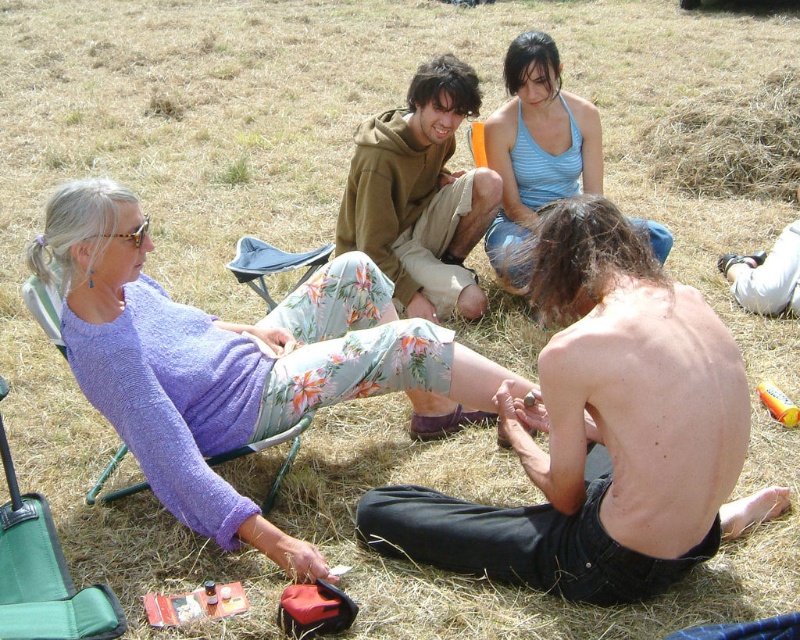
You are a photographer setting up a tripod between the green fabric folding chair at lower left and the green fabric chair at lower left. The tripod requires a minimum of 1.5 meters of space to set up. Can you fit the tripod between them?

The green fabric folding chair at lower left and the green fabric chair at lower left are 1.57 meters apart, which is just enough space to fit the tripod since it requires a minimum of 1.5 meters.

You are standing at the center of the grassy field and want to move towards the shiny black skin at lower right. Which direction should you walk to reach it?

To reach the shiny black skin at lower right, you should walk towards the lower right direction since its coordinates are at point (601, 433).